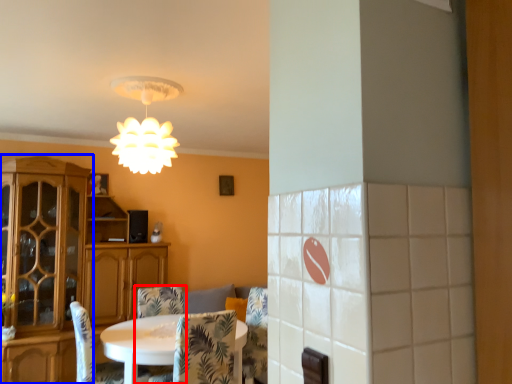
Question: Which object appears closest to the camera in this image, chair (highlighted by a red box) or cabinetry (highlighted by a blue box)?

Choices:
 (A) chair
 (B) cabinetry

Answer: (A)